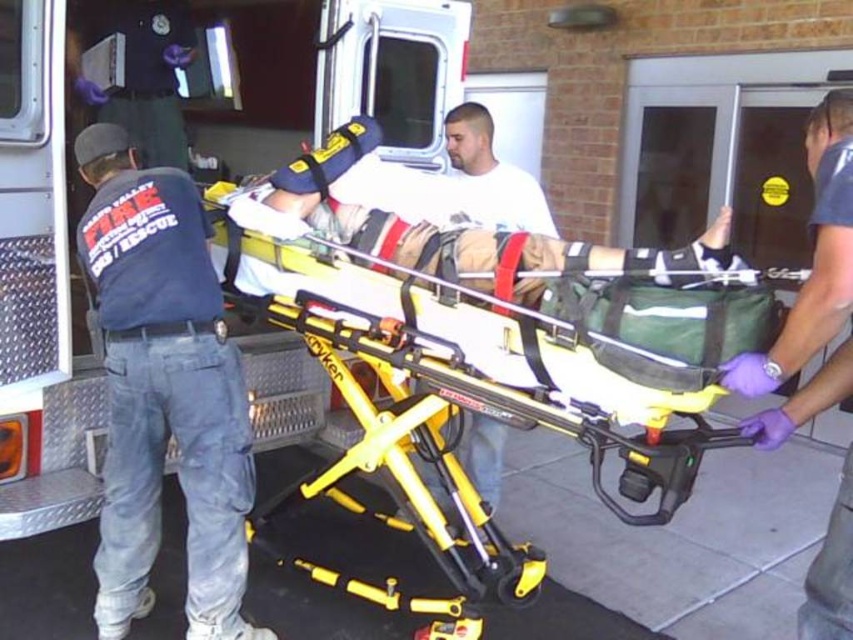
Between purple-latex-gloved-hand at right and white matte shirt at center, which one has more height?

Standing taller between the two is purple-latex-gloved-hand at right.

Is purple-latex-gloved-hand at right shorter than white matte shirt at center?

Incorrect, purple-latex-gloved-hand at right's height does not fall short of white matte shirt at center's.

Which is in front, point (788, 433) or point (474, 115)?

Point (788, 433) is more forward.

I want to click on purple-latex-gloved-hand at right, so click(813, 257).

Is dark blue uniform at left shorter than purple-latex-gloved-hand at right?

In fact, dark blue uniform at left may be taller than purple-latex-gloved-hand at right.

Who is shorter, dark blue uniform at left or purple-latex-gloved-hand at right?

With less height is purple-latex-gloved-hand at right.

Which is behind, point (192, 285) or point (813, 608)?

Point (192, 285)

At what (x,y) coordinates should I click in order to perform the action: click on dark blue uniform at left. Please return your answer as a coordinate pair (x, y). Looking at the image, I should click on (163, 392).

Between point (614, 400) and point (170, 378), which one is positioned behind?

Point (170, 378)

Does yellow metallic stretcher at center have a larger size compared to dark blue uniform at left?

Correct, yellow metallic stretcher at center is larger in size than dark blue uniform at left.

In order to click on yellow metallic stretcher at center in this screenshot , I will do `click(494, 371)`.

Locate an element on the screen. The width and height of the screenshot is (853, 640). yellow metallic stretcher at center is located at coordinates (494, 371).